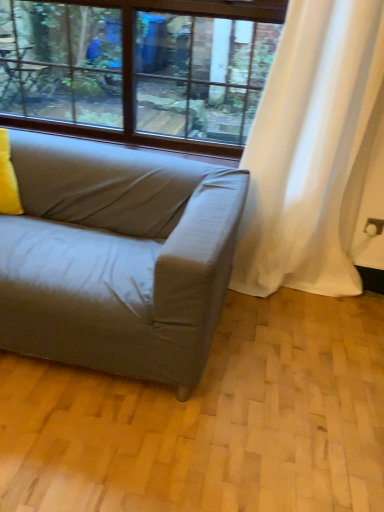
Question: From the image's perspective, does yellow fabric pillow at left appear higher than clear glass window at upper center?

Choices:
 (A) no
 (B) yes

Answer: (A)

Question: Is yellow fabric pillow at left surrounding clear glass window at upper center?

Choices:
 (A) no
 (B) yes

Answer: (A)

Question: From the image's perspective, is yellow fabric pillow at left located beneath clear glass window at upper center?

Choices:
 (A) no
 (B) yes

Answer: (B)

Question: Can you confirm if yellow fabric pillow at left is wider than clear glass window at upper center?

Choices:
 (A) no
 (B) yes

Answer: (B)

Question: Is yellow fabric pillow at left aimed at clear glass window at upper center?

Choices:
 (A) yes
 (B) no

Answer: (B)

Question: Is yellow fabric pillow at left turned away from clear glass window at upper center?

Choices:
 (A) no
 (B) yes

Answer: (A)

Question: From a real-world perspective, does white sheer curtain at right sit lower than matte gray couch at lower left?

Choices:
 (A) no
 (B) yes

Answer: (A)

Question: Is white sheer curtain at right bigger than matte gray couch at lower left?

Choices:
 (A) yes
 (B) no

Answer: (B)

Question: Can matte gray couch at lower left be found inside white sheer curtain at right?

Choices:
 (A) yes
 (B) no

Answer: (B)

Question: Is white sheer curtain at right turned away from matte gray couch at lower left?

Choices:
 (A) yes
 (B) no

Answer: (B)

Question: Can you confirm if white sheer curtain at right is positioned to the right of matte gray couch at lower left?

Choices:
 (A) no
 (B) yes

Answer: (B)

Question: Is the position of white sheer curtain at right less distant than that of matte gray couch at lower left?

Choices:
 (A) yes
 (B) no

Answer: (B)

Question: From a real-world perspective, is yellow fabric pillow at left on white sheer curtain at right?

Choices:
 (A) yes
 (B) no

Answer: (B)